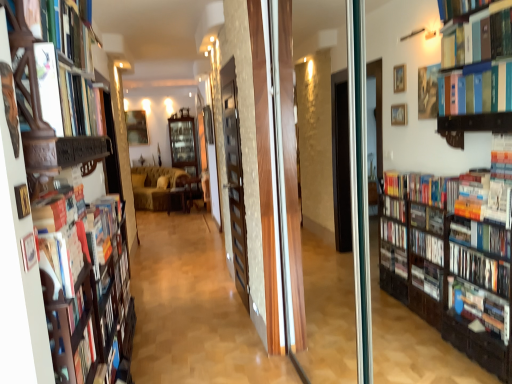
Question: From the image's perspective, is wooden chair at center, which is counted as the 1th furniture, starting from the right, positioned above or below hardcover book at upper left, which ranks as the 1th book in top-to-bottom order?

Choices:
 (A) above
 (B) below

Answer: (B)

Question: From a real-world perspective, relative to hardcover book at upper left, which ranks as the 1th book in top-to-bottom order, is wooden chair at center, which appears as the 2th furniture when viewed from the left, vertically above or below?

Choices:
 (A) above
 (B) below

Answer: (B)

Question: Which is farther from the wooden picture frame at center?

Choices:
 (A) wooden chair at center, which is counted as the 1th furniture, starting from the right
 (B) wooden bookshelf at left, the 2th shelf positioned from the back
 (C) hardcover book at left, the second book from the top
 (D) hardcover book at upper left, which ranks as the 2th book in bottom-to-top order
 (E) wooden cabinet at center, which is counted as the 2th furniture, starting from the right

Answer: (B)

Question: Based on their relative distances, which object is nearer to the hardcover book at upper left, the first book viewed from the front?

Choices:
 (A) velvet yellow couch at center
 (B) hardcover book at left, which is the 1th book from bottom to top
 (C) wooden cabinet at center, the first shelf from the left
 (D) wooden picture frame at center
 (E) wooden bookshelf at left

Answer: (B)